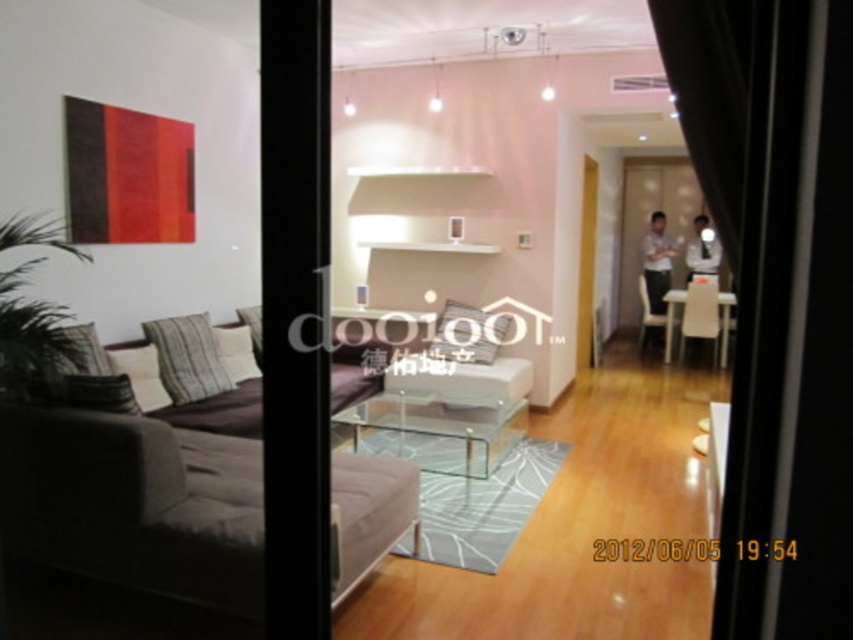
Based on the photo, is suede couch at left below transparent glass table at center?

Incorrect, suede couch at left is not positioned below transparent glass table at center.

What do you see at coordinates (134, 502) in the screenshot? I see `suede couch at left` at bounding box center [134, 502].

Locate an element on the screen. suede couch at left is located at coordinates (134, 502).

At what (x,y) coordinates should I click in order to perform the action: click on suede couch at left. Please return your answer as a coordinate pair (x, y). Image resolution: width=853 pixels, height=640 pixels. Looking at the image, I should click on (134, 502).

This screenshot has height=640, width=853. I want to click on suede couch at left, so click(134, 502).

Can you confirm if suede couch at left is positioned above black fabric curtain at right?

Incorrect, suede couch at left is not positioned above black fabric curtain at right.

Which is behind, point (260, 609) or point (660, 4)?

Positioned behind is point (260, 609).

Where is `suede couch at left`? This screenshot has height=640, width=853. suede couch at left is located at coordinates (134, 502).

Who is more distant from viewer, (778,124) or (285,484)?

The point (285,484) is behind.

Is black fabric curtain at right positioned before transparent glass door at center?

Yes.

You are a GUI agent. You are given a task and a screenshot of the screen. Output one action in this format:
    pyautogui.click(x=<x>, y=<y>)
    Task: Click on the black fabric curtain at right
    This screenshot has width=853, height=640.
    Given the screenshot: What is the action you would take?
    pyautogui.click(x=747, y=237)